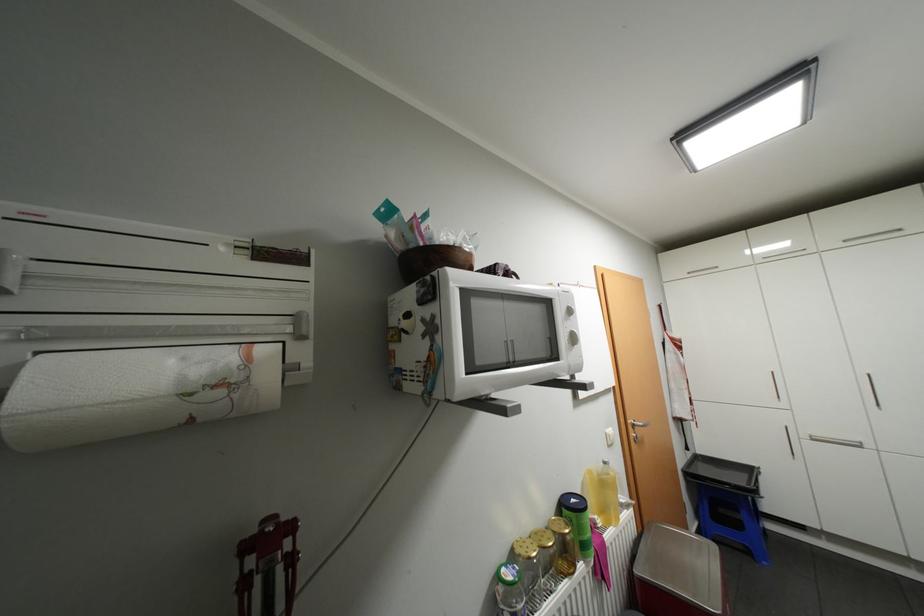
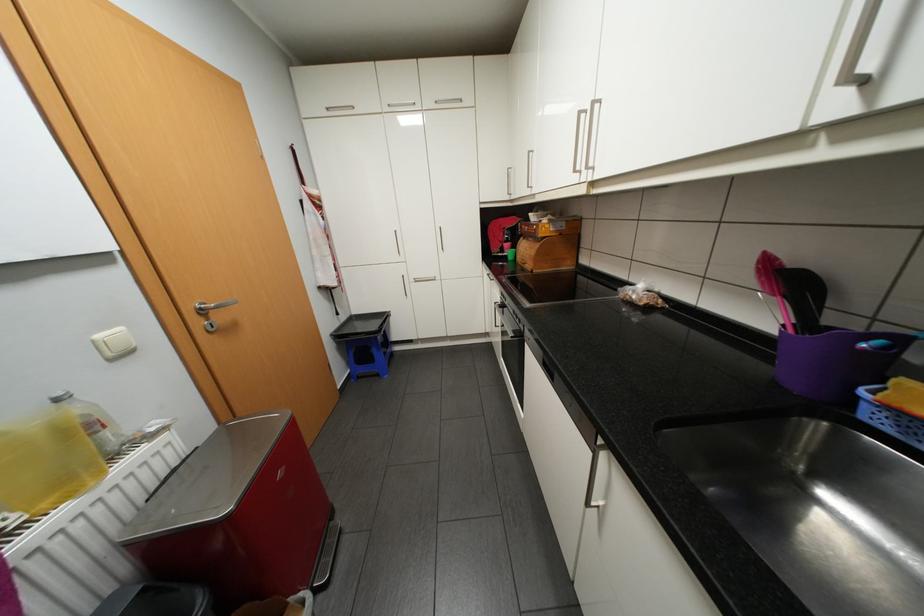
The point at (756, 552) is marked in the first image. Where is the corresponding point in the second image?

(385, 374)